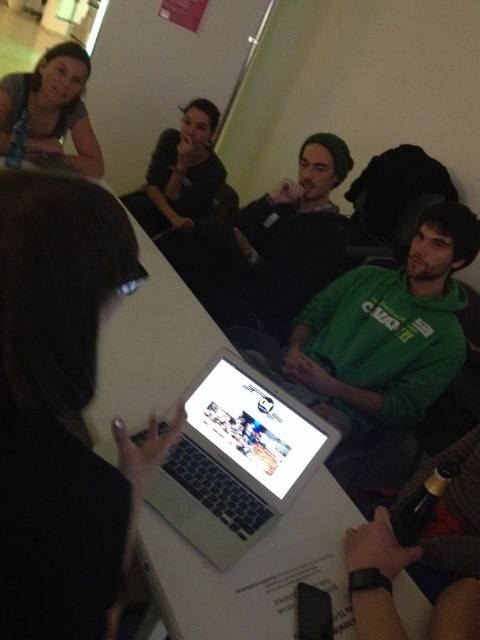
Is white glossy table at center positioned at the back of silver metallic laptop at center?

No.

Image resolution: width=480 pixels, height=640 pixels. What are the coordinates of `white glossy table at center` in the screenshot? It's located at (59, 525).

Does silver metallic laptop at center appear over black knit cap at center?

No, silver metallic laptop at center is not above black knit cap at center.

Can you confirm if silver metallic laptop at center is smaller than black knit cap at center?

Yes, silver metallic laptop at center is smaller than black knit cap at center.

Locate an element on the screen. This screenshot has width=480, height=640. silver metallic laptop at center is located at coordinates (237, 460).

Is white glossy laptop at center below matte gray shirt at upper left?

Correct, white glossy laptop at center is located below matte gray shirt at upper left.

Does point (275, 488) come behind point (73, 170)?

No, it is not.

Where is `white glossy laptop at center`? The image size is (480, 640). white glossy laptop at center is located at coordinates [x=252, y=426].